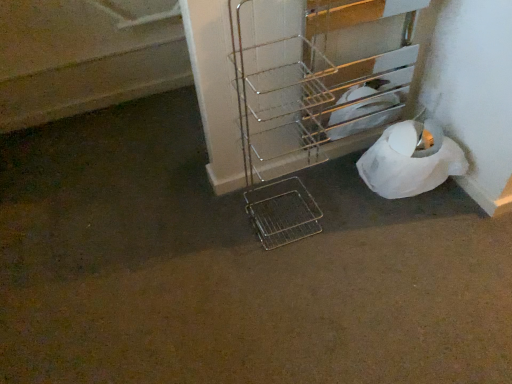
Question: Is metallic wire trolley at lower right, placed as the 2th trolley when sorted from left to right, shorter than white paper at lower right?

Choices:
 (A) yes
 (B) no

Answer: (B)

Question: Considering the relative sizes of metallic wire trolley at lower right, acting as the first trolley starting from the right, and white paper at lower right in the image provided, is metallic wire trolley at lower right, acting as the first trolley starting from the right, thinner than white paper at lower right?

Choices:
 (A) yes
 (B) no

Answer: (A)

Question: From a real-world perspective, is metallic wire trolley at lower right, placed as the 2th trolley when sorted from left to right, over white paper at lower right?

Choices:
 (A) no
 (B) yes

Answer: (B)

Question: From the image's perspective, does metallic wire trolley at lower right, acting as the first trolley starting from the right, appear lower than white paper at lower right?

Choices:
 (A) no
 (B) yes

Answer: (A)

Question: Is metallic wire trolley at lower right, acting as the first trolley starting from the right, surrounding white paper at lower right?

Choices:
 (A) yes
 (B) no

Answer: (B)

Question: Visually, is metallic wire trolley at center, marked as the second trolley in a right-to-left arrangement, positioned to the left or to the right of white paper at lower right?

Choices:
 (A) right
 (B) left

Answer: (B)

Question: From a real-world perspective, is metallic wire trolley at center, the first trolley in the left-to-right sequence, positioned above or below white paper at lower right?

Choices:
 (A) above
 (B) below

Answer: (A)

Question: From their relative heights in the image, would you say metallic wire trolley at center, the first trolley in the left-to-right sequence, is taller or shorter than white paper at lower right?

Choices:
 (A) short
 (B) tall

Answer: (B)

Question: From the image's perspective, relative to white paper at lower right, is metallic wire trolley at center, marked as the second trolley in a right-to-left arrangement, above or below?

Choices:
 (A) below
 (B) above

Answer: (B)

Question: In terms of height, does metallic wire trolley at lower right, acting as the first trolley starting from the right, look taller or shorter compared to metallic wire trolley at center, marked as the second trolley in a right-to-left arrangement?

Choices:
 (A) short
 (B) tall

Answer: (A)

Question: Do you think metallic wire trolley at lower right, placed as the 2th trolley when sorted from left to right, is within metallic wire trolley at center, the first trolley in the left-to-right sequence, or outside of it?

Choices:
 (A) inside
 (B) outside

Answer: (B)

Question: From the image's perspective, relative to metallic wire trolley at center, marked as the second trolley in a right-to-left arrangement, is metallic wire trolley at lower right, acting as the first trolley starting from the right, above or below?

Choices:
 (A) above
 (B) below

Answer: (A)

Question: Considering their positions, is metallic wire trolley at lower right, placed as the 2th trolley when sorted from left to right, located in front of or behind metallic wire trolley at center, the first trolley in the left-to-right sequence?

Choices:
 (A) behind
 (B) front

Answer: (A)

Question: Is metallic wire trolley at lower right, acting as the first trolley starting from the right, situated inside white paper at lower right or outside?

Choices:
 (A) inside
 (B) outside

Answer: (B)

Question: Is metallic wire trolley at lower right, acting as the first trolley starting from the right, wider or thinner than white paper at lower right?

Choices:
 (A) wide
 (B) thin

Answer: (B)